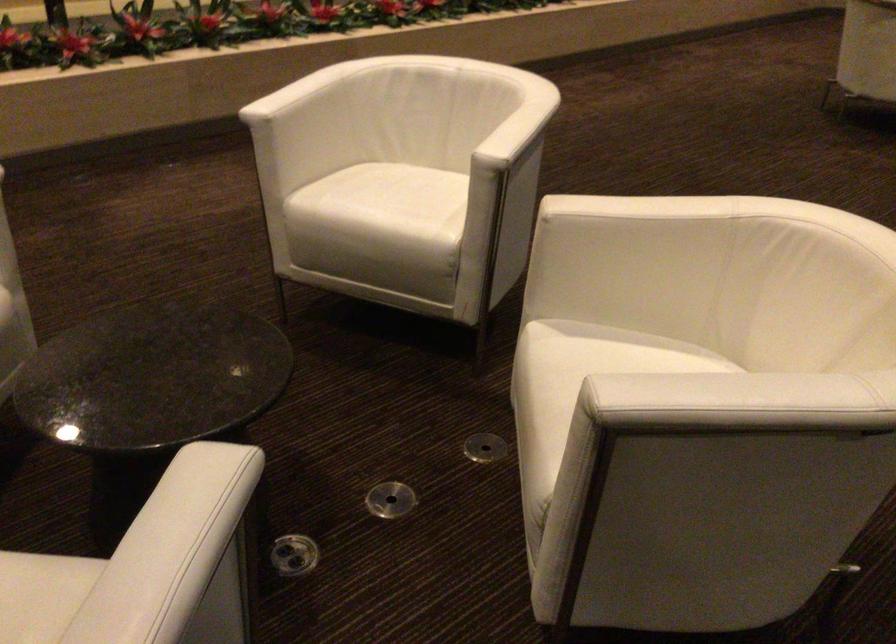
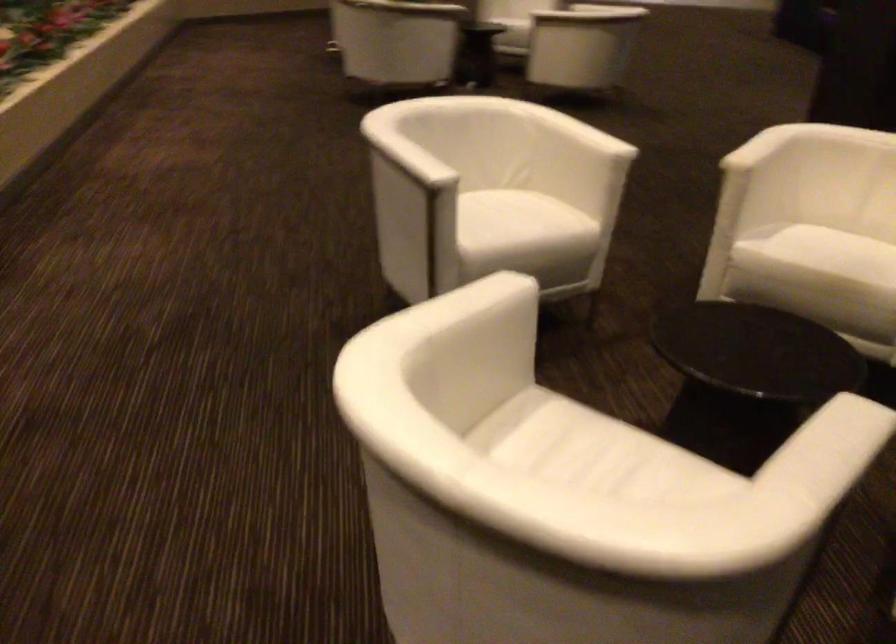
Locate, in the second image, the point that corresponds to (x=536, y=380) in the first image.

(836, 252)